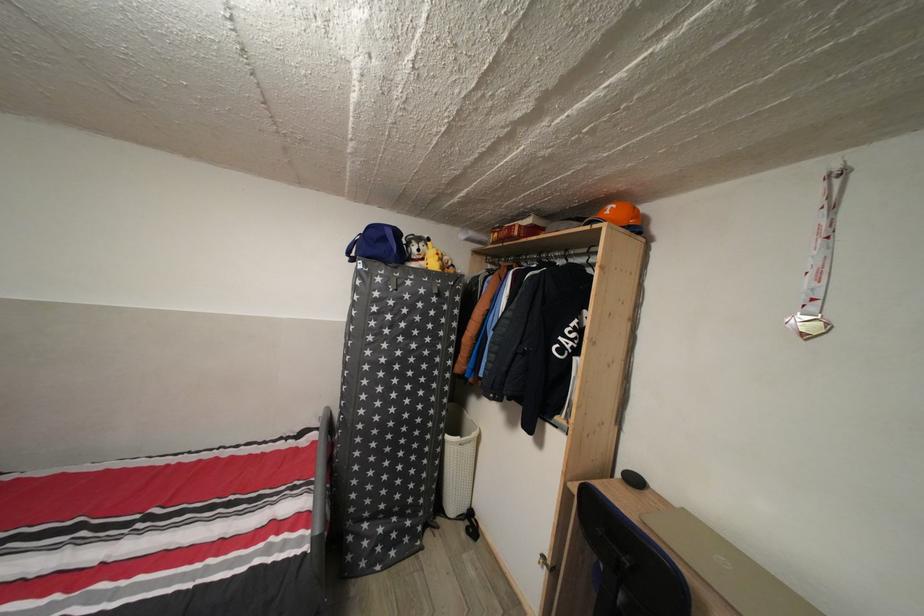
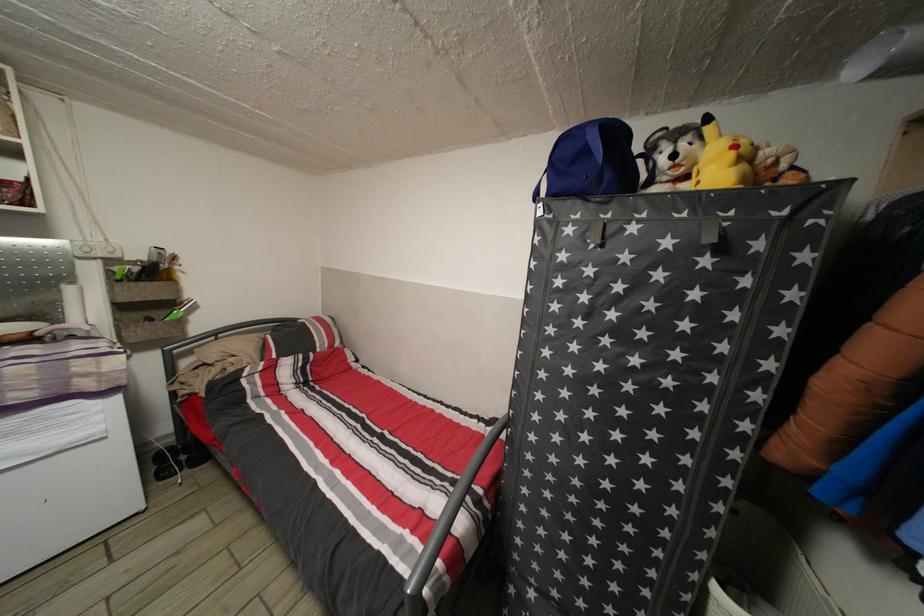
In the second image, find the point that corresponds to pixel 391 246 in the first image.

(591, 158)